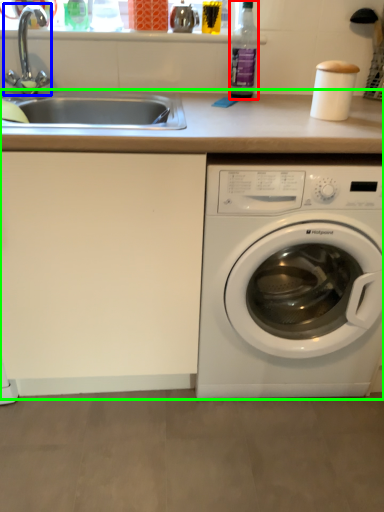
Question: Estimate the real-world distances between objects in this image. Which object is closer to bottle (highlighted by a red box), faucet (highlighted by a blue box) or counter top (highlighted by a green box)?

Choices:
 (A) faucet
 (B) counter top

Answer: (A)